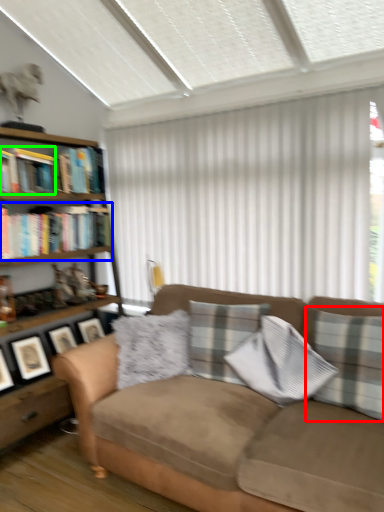
Question: Which object is positioned farthest from pillow (highlighted by a red box)? Select from book (highlighted by a blue box) and book (highlighted by a green box).

Choices:
 (A) book
 (B) book

Answer: (B)